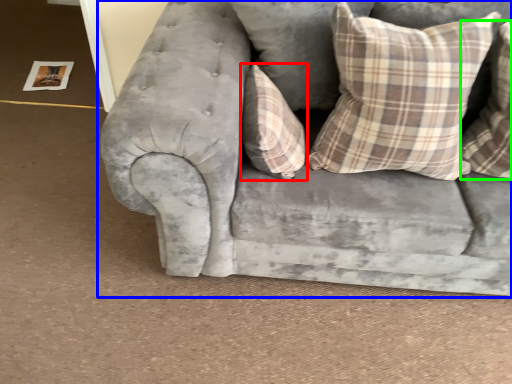
Question: Which is farther away from pillow (highlighted by a red box)? studio couch (highlighted by a blue box) or pillow (highlighted by a green box)?

Choices:
 (A) studio couch
 (B) pillow

Answer: (B)